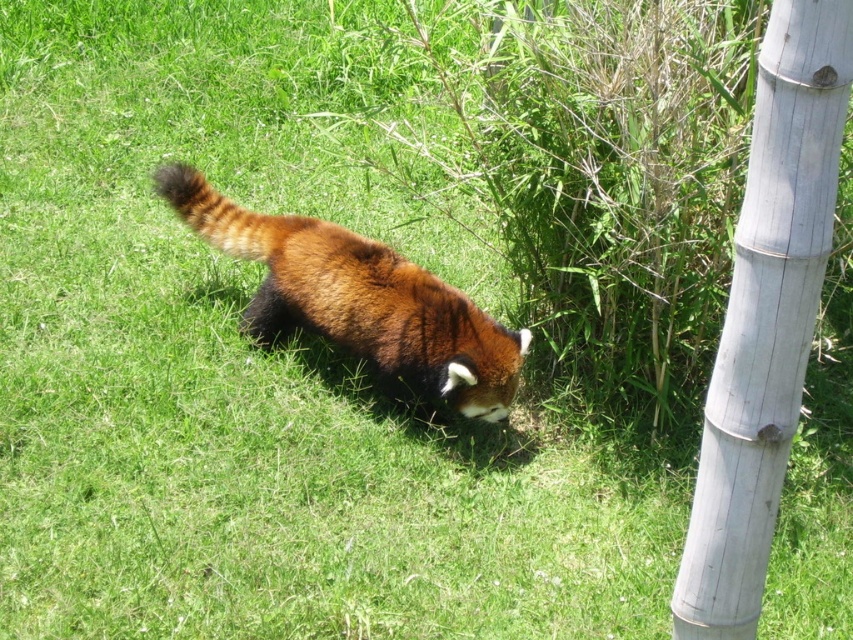
Question: Does white bamboo pole at right lie behind fuzzy reddish-brown animal at center?

Choices:
 (A) no
 (B) yes

Answer: (A)

Question: Where is white bamboo pole at right located in relation to fuzzy reddish-brown animal at center in the image?

Choices:
 (A) above
 (B) below

Answer: (B)

Question: Can you confirm if white bamboo pole at right is positioned to the right of fuzzy reddish-brown animal at center?

Choices:
 (A) no
 (B) yes

Answer: (B)

Question: Which point appears closest to the camera in this image?

Choices:
 (A) (804, 45)
 (B) (519, 371)

Answer: (A)